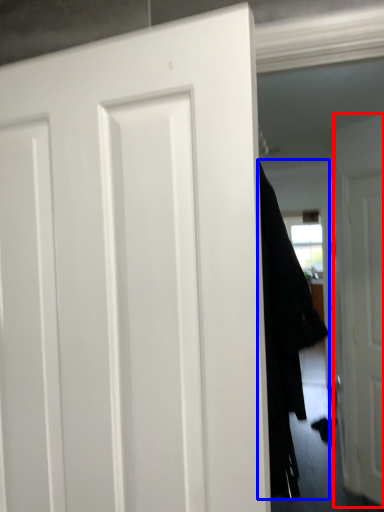
Question: Which object appears farthest to the camera in this image, door (highlighted by a red box) or garment (highlighted by a blue box)?

Choices:
 (A) door
 (B) garment

Answer: (A)